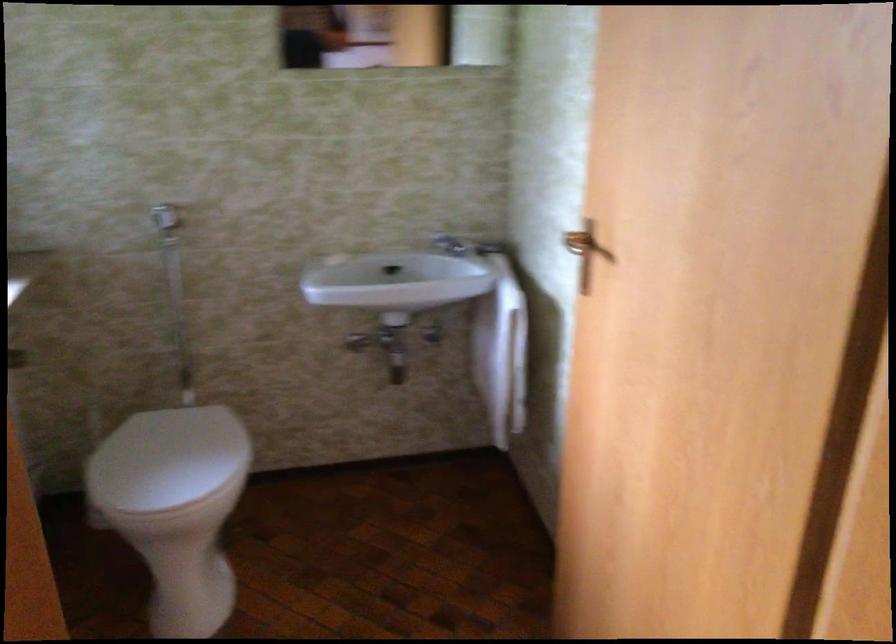
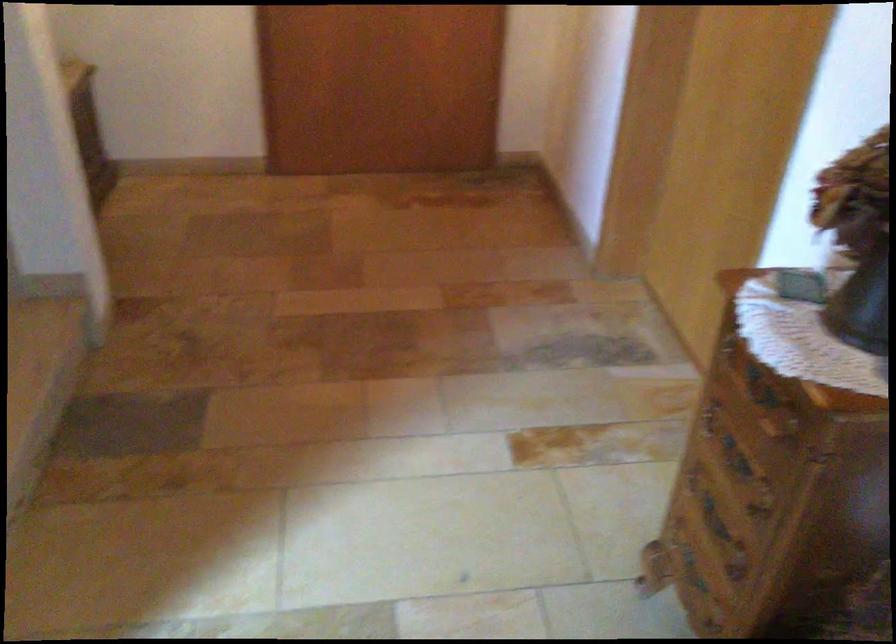
First-person continuous shooting, in which direction is the camera rotating?

The camera's rotation is toward right-down.